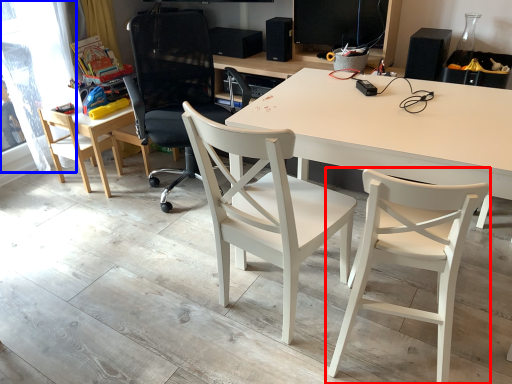
Question: Among these objects, which one is farthest to the camera, chair (highlighted by a red box) or window screen (highlighted by a blue box)?

Choices:
 (A) chair
 (B) window screen

Answer: (B)